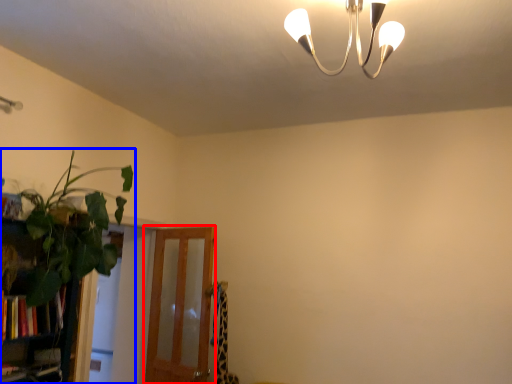
Question: Among these objects, which one is nearest to the camera, screen door (highlighted by a red box) or houseplant (highlighted by a blue box)?

Choices:
 (A) screen door
 (B) houseplant

Answer: (B)